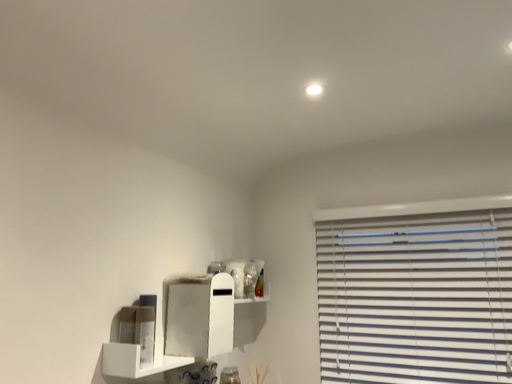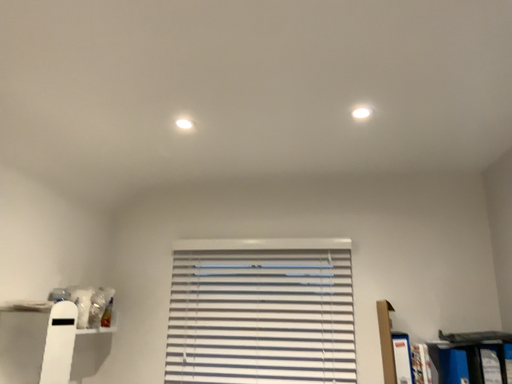
Question: How did the camera likely rotate when shooting the video?

Choices:
 (A) rotated right
 (B) rotated left

Answer: (A)